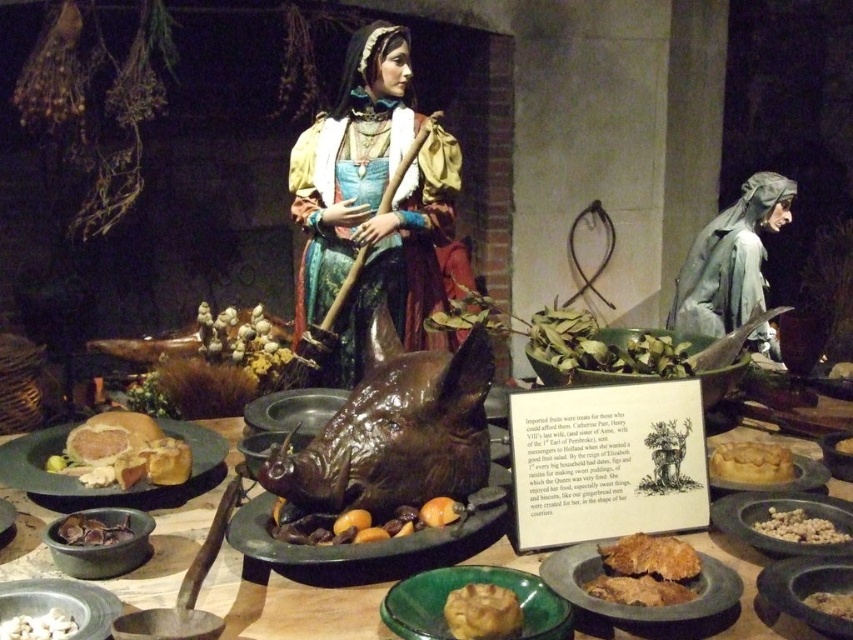
What is the exact coordinate of the matte brown bowl at lower right?

The matte brown bowl at lower right is located at coordinate point (807, 589).

You are a medieval servant who needs to carry both the matte brown bowl at lower right and the matte gray bowl at lower left to the dining table. The path between them is narrow. Can you comfortably carry both bowls at the same time if you hold them side by side?

The matte brown bowl at lower right is 1.30 meters away from the matte gray bowl at lower left. Since the distance between them is 1.30 meters, you can comfortably carry both bowls side by side as the space allows enough room for the servant to maneuver.